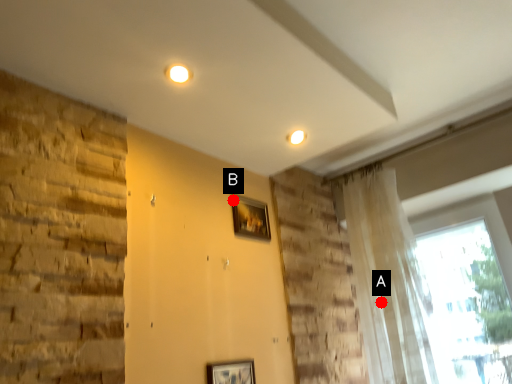
Question: Two points are circled on the image, labeled by A and B beside each circle. Which point is farther from the camera taking this photo?

Choices:
 (A) A is further
 (B) B is further

Answer: (A)